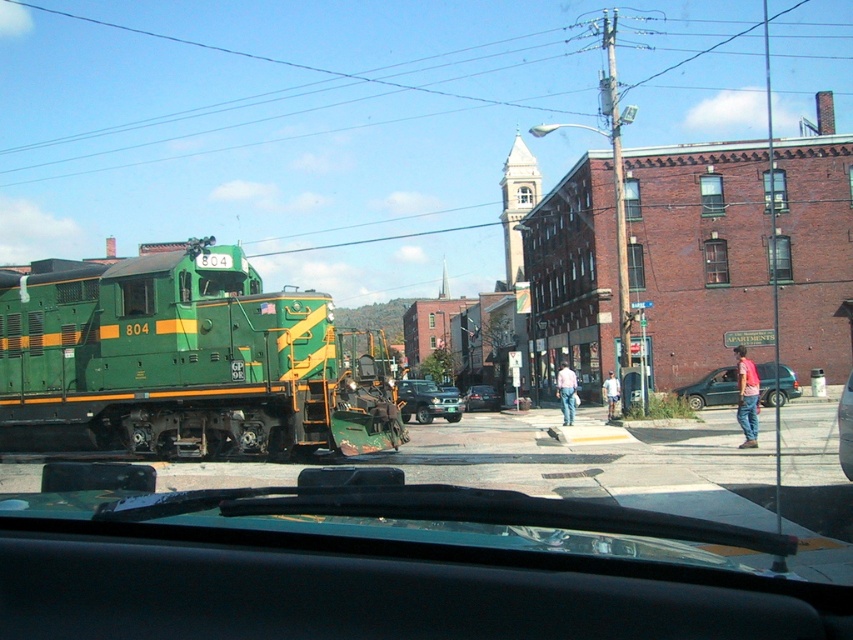
You are a driver in the metallic silver sedan at center. You need to pass by the green matte train at left. Can you safely do so without hitting it?

The green matte train at left is larger in size than the metallic silver sedan at center, so the driver can safely pass by the green matte train at left without hitting it as long as they maintain a safe distance.

Consider the image. You are a passenger in the vehicle and looking out the windshield. You notice the metallic gray van at right. Where is it located in relation to the green locomotive with yellow stripes?

The metallic gray van at right is located to the right of the green locomotive with yellow stripes.

You are a passenger in the metallic silver sedan at center and want to exit the vehicle through the driver side door. However, there is a green matte train at left blocking the path. Can you safely open the door without hitting the train?

The green matte train at left is in front of the metallic silver sedan at center, meaning it is closer to you. Since the train is blocking the path, opening the driver side door might result in collision. Do not open the door.